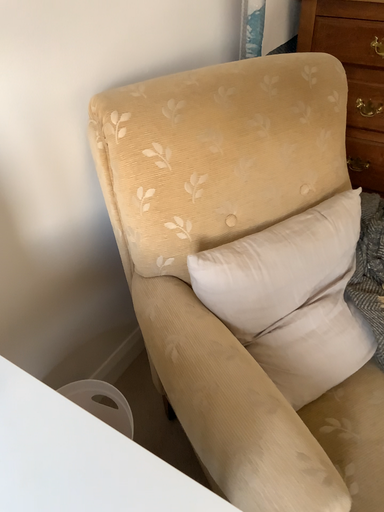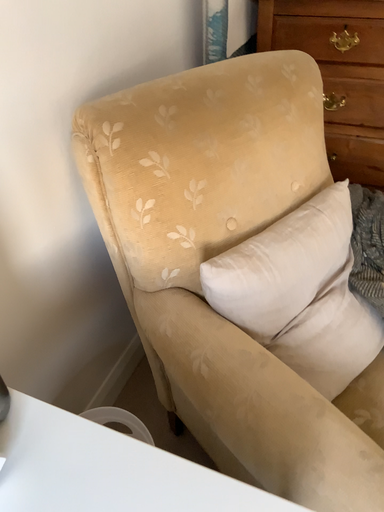
Question: How did the camera likely rotate when shooting the video?

Choices:
 (A) rotated left
 (B) rotated right

Answer: (B)